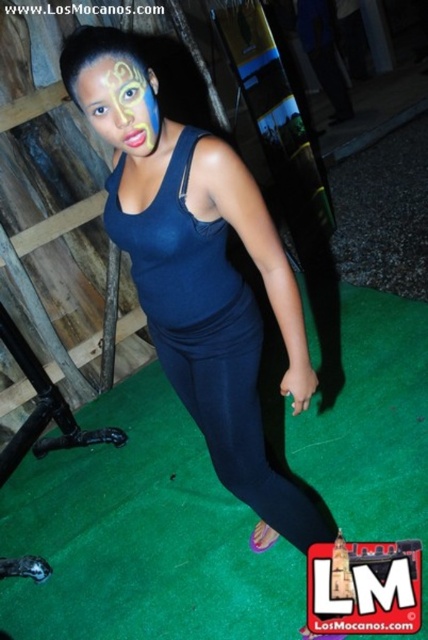
Question: Is satin dark blue pants at center to the left of yellow matte face paint at center from the viewer's perspective?

Choices:
 (A) yes
 (B) no

Answer: (B)

Question: Which of the following is the closest to the observer?

Choices:
 (A) (125, 170)
 (B) (146, 145)

Answer: (B)

Question: Which point is closer to the camera taking this photo?

Choices:
 (A) (303, 634)
 (B) (262, 493)

Answer: (B)

Question: Does satin dark blue pants at center appear on the left side of yellow matte face paint at center?

Choices:
 (A) yes
 (B) no

Answer: (B)

Question: Can you confirm if matte blue tank top at center is wider than satin dark blue pants at center?

Choices:
 (A) no
 (B) yes

Answer: (B)

Question: Among these objects, which one is farthest from the camera?

Choices:
 (A) yellow matte face paint at center
 (B) matte blue tank top at center
 (C) satin dark blue pants at center

Answer: (C)